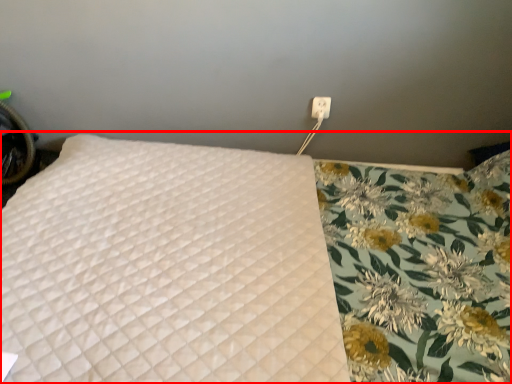
Question: Considering the relative positions of bed (annotated by the red box) and electric outlet in the image provided, where is bed (annotated by the red box) located with respect to the staircase?

Choices:
 (A) right
 (B) left

Answer: (B)